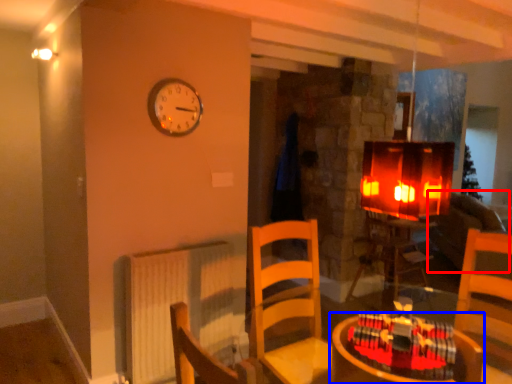
Question: Which point is closer to the camera, couch (highlighted by a red box) or table (highlighted by a blue box)?

Choices:
 (A) couch
 (B) table

Answer: (B)